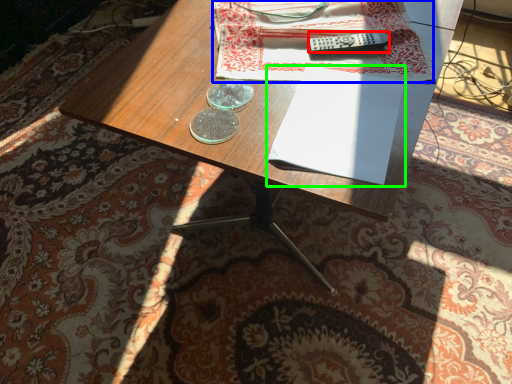
Question: Estimate the real-world distances between objects in this image. Which object is closer to remote control (highlighted by a red box), sheet (highlighted by a blue box) or paperback book (highlighted by a green box)?

Choices:
 (A) sheet
 (B) paperback book

Answer: (A)